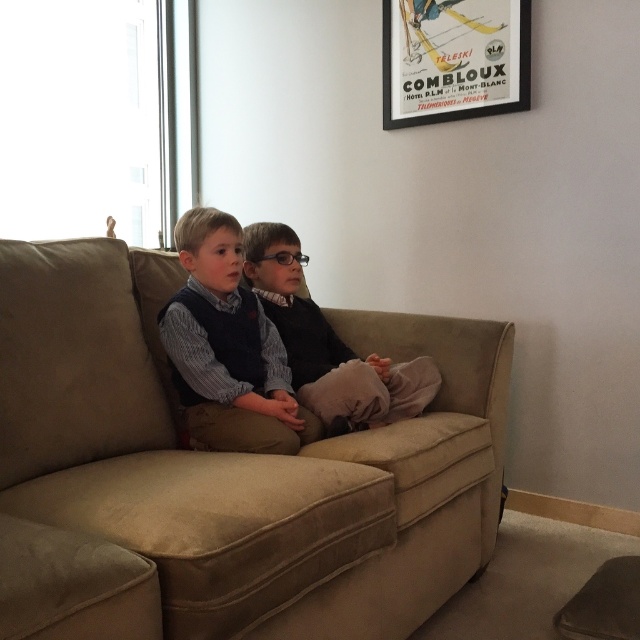
Does matte black poster at upper center appear under matte black sweater at center?

Incorrect, matte black poster at upper center is not positioned below matte black sweater at center.

Looking at this image, is matte black poster at upper center in front of matte black sweater at center?

No, matte black poster at upper center is behind matte black sweater at center.

Between point (429, 42) and point (312, 381), which one is positioned behind?

Point (429, 42)

Find the location of `matte black poster at upper center`. matte black poster at upper center is located at coordinates (452, 60).

Is beige fabric couch at center to the left of matte black sweater at center from the viewer's perspective?

Yes, beige fabric couch at center is to the left of matte black sweater at center.

Who is more distant from viewer, (362, 561) or (294, 246)?

Point (294, 246)

I want to click on beige fabric couch at center, so click(x=221, y=474).

Is point (257, 445) more distant than point (371, 412)?

No.

Who is more forward, (234,291) or (422,392)?

Point (234,291)

You are a GUI agent. You are given a task and a screenshot of the screen. Output one action in this format:
    pyautogui.click(x=<x>, y=<y>)
    Task: Click on the matte blue shirt at center
    The width and height of the screenshot is (640, 640).
    Given the screenshot: What is the action you would take?
    pyautogui.click(x=227, y=348)